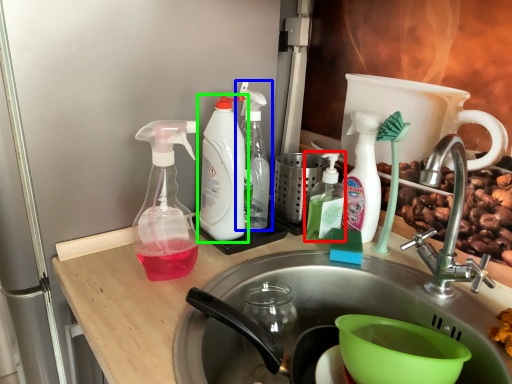
Question: Considering the real-world distances, which object is closest to bottle (highlighted by a red box)? bottle (highlighted by a blue box) or bottle (highlighted by a green box).

Choices:
 (A) bottle
 (B) bottle

Answer: (A)